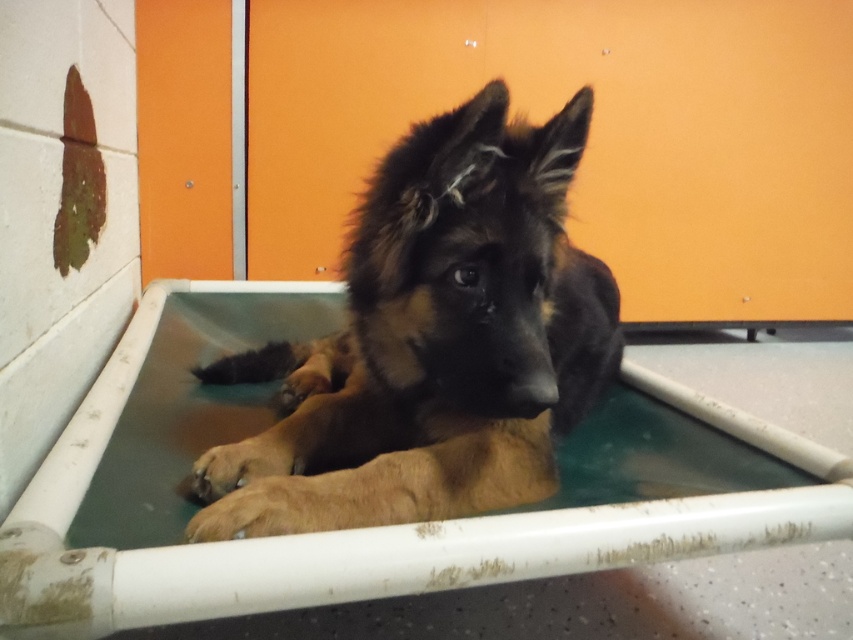
Question: Can you confirm if brown fur dog at center is bigger than green plastic bath at center?

Choices:
 (A) yes
 (B) no

Answer: (B)

Question: Is brown fur dog at center smaller than green plastic bath at center?

Choices:
 (A) yes
 (B) no

Answer: (A)

Question: Which point is closer to the camera?

Choices:
 (A) brown fur dog at center
 (B) green plastic bath at center

Answer: (B)

Question: Which of the following is the closest to the observer?

Choices:
 (A) brown fur dog at center
 (B) green plastic bath at center

Answer: (B)

Question: Is the position of brown fur dog at center more distant than that of green plastic bath at center?

Choices:
 (A) yes
 (B) no

Answer: (A)